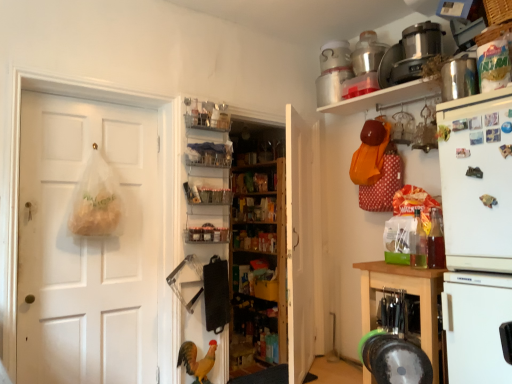
Question: Is wooden shelves at center, the 1th bookshelf in the back-to-front sequence, at the right side of metallic stainless steel container at upper right, marked as the second appliance in a back-to-front arrangement?

Choices:
 (A) no
 (B) yes

Answer: (A)

Question: Is wooden shelves at center, the 2th bookshelf from the front, behind metallic stainless steel container at upper right, marked as the second appliance in a top-to-bottom arrangement?

Choices:
 (A) yes
 (B) no

Answer: (A)

Question: Considering the relative sizes of wooden shelves at center, the 2th bookshelf from the front, and metallic stainless steel container at upper right, marked as the second appliance in a back-to-front arrangement, in the image provided, is wooden shelves at center, the 2th bookshelf from the front, smaller than metallic stainless steel container at upper right, marked as the second appliance in a back-to-front arrangement,?

Choices:
 (A) yes
 (B) no

Answer: (B)

Question: Can we say wooden shelves at center, the 2th bookshelf from the front, lies outside metallic stainless steel container at upper right, which is counted as the 2th appliance, starting from the front?

Choices:
 (A) yes
 (B) no

Answer: (A)

Question: Can you confirm if wooden shelves at center, the 1th bookshelf in the back-to-front sequence, is positioned to the left of metallic stainless steel container at upper right, which is counted as the 2th appliance, starting from the front?

Choices:
 (A) no
 (B) yes

Answer: (B)

Question: In terms of width, does clear plastic shelves at center, acting as the 4th shelf starting from the right, look wider or thinner when compared to wooden cabinet at lower right?

Choices:
 (A) wide
 (B) thin

Answer: (B)

Question: Is point (207, 150) positioned closer to the camera than point (362, 284)?

Choices:
 (A) farther
 (B) closer

Answer: (A)

Question: From a real-world perspective, is clear plastic shelves at center, placed as the second shelf when sorted from top to bottom, physically located above or below wooden cabinet at lower right?

Choices:
 (A) above
 (B) below

Answer: (A)

Question: Is clear plastic shelves at center, acting as the 4th shelf starting from the right, to the left or to the right of wooden cabinet at lower right in the image?

Choices:
 (A) left
 (B) right

Answer: (A)

Question: Looking at their shapes, would you say white matte door at center, positioned as the 1th door in right-to-left order, is wider or thinner than metallic silver magnet at upper right, the 2th magnet positioned from the top?

Choices:
 (A) wide
 (B) thin

Answer: (A)

Question: From a real-world perspective, is white matte door at center, arranged as the second door when viewed from the left, positioned above or below metallic silver magnet at upper right, which is the 1th magnet from bottom to top?

Choices:
 (A) below
 (B) above

Answer: (A)

Question: In the image, is white matte door at center, positioned as the 1th door in right-to-left order, on the left side or the right side of metallic silver magnet at upper right, the 2th magnet positioned from the top?

Choices:
 (A) right
 (B) left

Answer: (B)

Question: Is white matte door at center, arranged as the second door when viewed from the left, situated inside metallic silver magnet at upper right, the 2th magnet positioned from the top, or outside?

Choices:
 (A) outside
 (B) inside

Answer: (A)

Question: Looking at the image, does metallic silver magnet at upper right, the 2th magnet positioned from the top, seem bigger or smaller compared to translucent plastic coffee cup at right?

Choices:
 (A) big
 (B) small

Answer: (B)

Question: In terms of height, does metallic silver magnet at upper right, which is the 1th magnet from bottom to top, look taller or shorter compared to translucent plastic coffee cup at right?

Choices:
 (A) tall
 (B) short

Answer: (B)